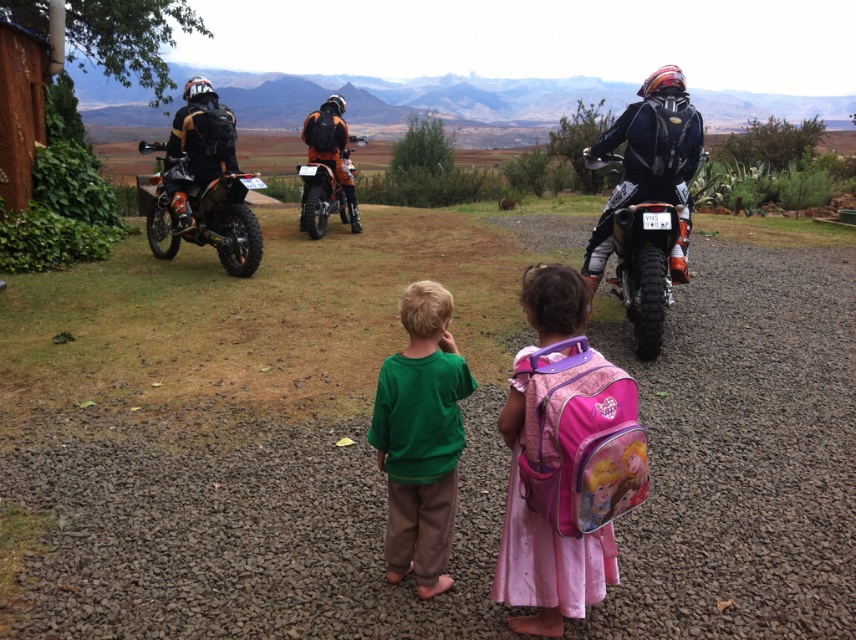
Is orange matte motorcycle at right above orange matte motorcycle at center?

No.

Can you confirm if orange matte motorcycle at right is positioned to the right of orange matte motorcycle at center?

Yes, orange matte motorcycle at right is to the right of orange matte motorcycle at center.

Is point (623, 262) positioned in front of point (308, 172)?

That is True.

The image size is (856, 640). Find the location of `orange matte motorcycle at right`. orange matte motorcycle at right is located at coordinates click(645, 268).

Who is more forward, (x=456, y=369) or (x=642, y=301)?

Point (x=456, y=369)

Does green cotton shirt at center appear over orange matte motorcycle at right?

No, green cotton shirt at center is not above orange matte motorcycle at right.

Is point (444, 582) closer to camera compared to point (634, 257)?

That is True.

Where is `green cotton shirt at center`? This screenshot has width=856, height=640. green cotton shirt at center is located at coordinates (420, 438).

The image size is (856, 640). Describe the element at coordinates (563, 460) in the screenshot. I see `pink fabric backpack at center` at that location.

Between pink fabric backpack at center and orange matte motorcycle at right, which one appears on the right side from the viewer's perspective?

orange matte motorcycle at right

Does point (539, 412) come closer to viewer compared to point (664, 216)?

Yes.

Where is `pink fabric backpack at center`? The image size is (856, 640). pink fabric backpack at center is located at coordinates (563, 460).